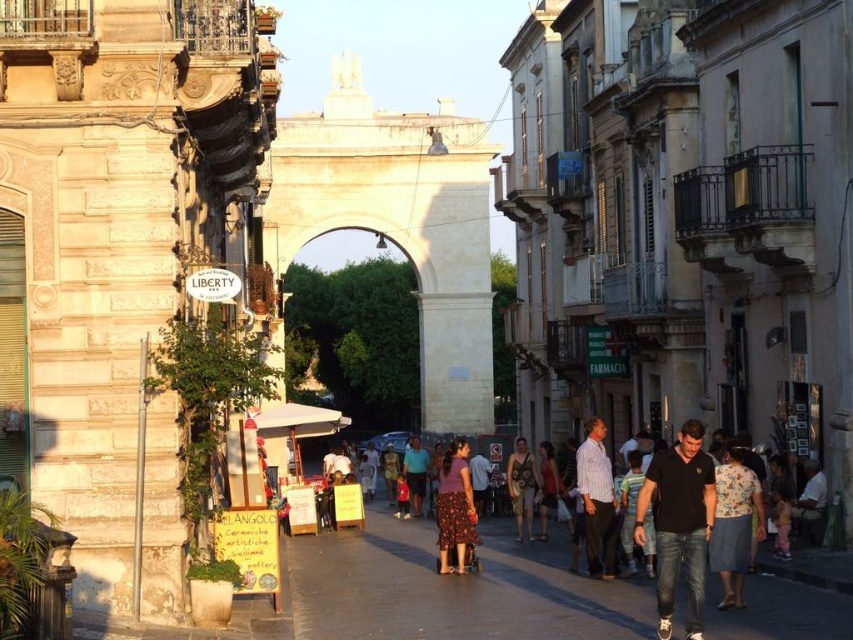
What do you see at coordinates (453, 588) in the screenshot? I see `smooth concrete sidewalk at center` at bounding box center [453, 588].

Who is positioned more to the left, smooth concrete sidewalk at center or matte blue shirt at center?

Positioned to the left is matte blue shirt at center.

Locate an element on the screen. smooth concrete sidewalk at center is located at coordinates (453, 588).

Between point (439, 532) and point (526, 508), which one is positioned behind?

Positioned behind is point (526, 508).

Is floral skirt at center to the left of gold textured dress at center from the viewer's perspective?

Correct, you'll find floral skirt at center to the left of gold textured dress at center.

Which is in front, point (467, 499) or point (508, 468)?

Point (467, 499) is more forward.

Identify the location of floral skirt at center. (456, 508).

Who is positioned more to the left, smooth concrete sidewalk at center or floral skirt at center?

Positioned to the left is smooth concrete sidewalk at center.

Is smooth concrete sidewalk at center thinner than floral skirt at center?

In fact, smooth concrete sidewalk at center might be wider than floral skirt at center.

At what (x,y) coordinates should I click in order to perform the action: click on smooth concrete sidewalk at center. Please return your answer as a coordinate pair (x, y). The height and width of the screenshot is (640, 853). Looking at the image, I should click on (453, 588).